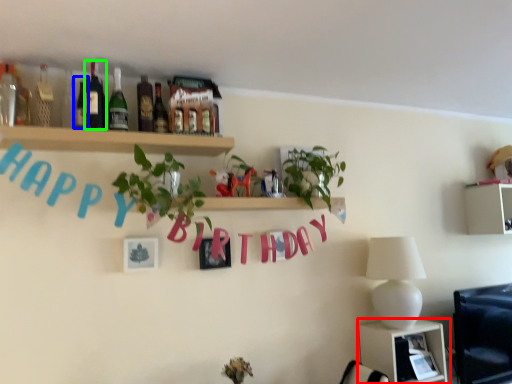
Question: Which object is the farthest from shelf (highlighted by a red box)? Choose among these: bottle (highlighted by a blue box) or bottle (highlighted by a green box).

Choices:
 (A) bottle
 (B) bottle

Answer: (A)